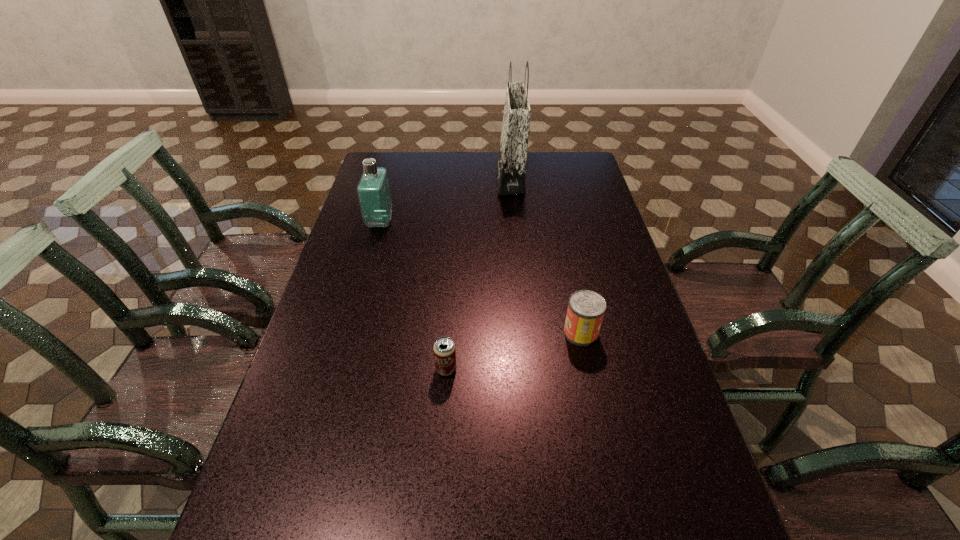
Where is `the farthest object`? The width and height of the screenshot is (960, 540). the farthest object is located at coordinates (511, 161).

This screenshot has height=540, width=960. I want to click on shopping bag, so click(511, 161).

You are a GUI agent. You are given a task and a screenshot of the screen. Output one action in this format:
    pyautogui.click(x=<x>, y=<y>)
    Task: Click on the leftmost object
    This screenshot has height=540, width=960.
    Given the screenshot: What is the action you would take?
    pyautogui.click(x=373, y=189)

The height and width of the screenshot is (540, 960). I want to click on the second farthest object, so click(373, 189).

The height and width of the screenshot is (540, 960). Identify the location of the second nearest object. (586, 308).

At what (x,y) coordinates should I click in order to perform the action: click on can. Please return your answer as a coordinate pair (x, y). The width and height of the screenshot is (960, 540). Looking at the image, I should click on (586, 308).

Locate an element on the screen. The height and width of the screenshot is (540, 960). beer can is located at coordinates (444, 348).

This screenshot has width=960, height=540. Find the location of `the shortest object`. the shortest object is located at coordinates (444, 348).

Where is `vacant space located 0.220m on the front of the farthest object with the design`? This screenshot has width=960, height=540. vacant space located 0.220m on the front of the farthest object with the design is located at coordinates (441, 179).

The height and width of the screenshot is (540, 960). In order to click on blank space located on the front of the farthest object with the design in this screenshot , I will do `click(410, 179)`.